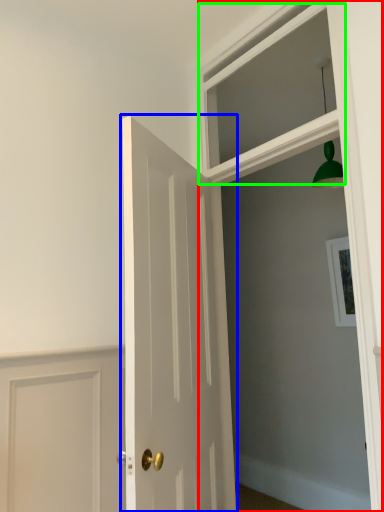
Question: Which object is positioned closest to window frame (highlighted by a red box)? Select from door (highlighted by a blue box) and window (highlighted by a green box).

Choices:
 (A) door
 (B) window

Answer: (B)